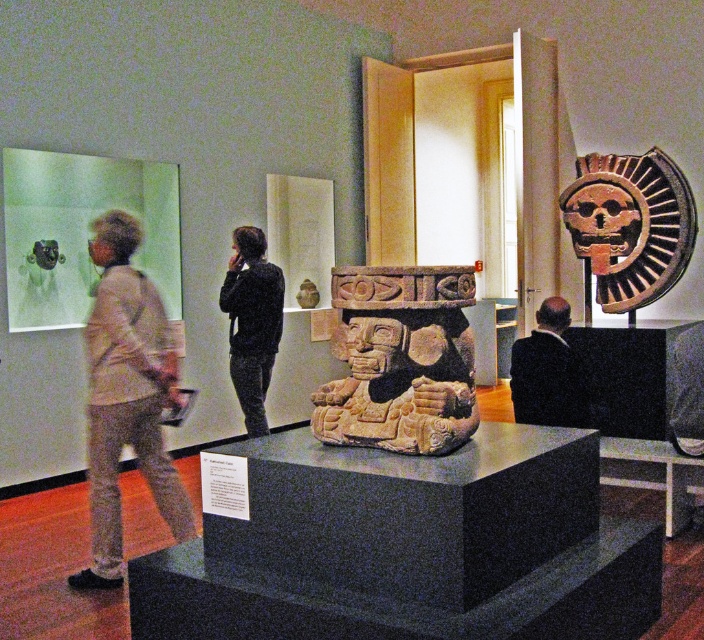
Between carved stone sculpture at center and black textured jacket at center, which one appears on the left side from the viewer's perspective?

black textured jacket at center

This screenshot has height=640, width=704. Describe the element at coordinates (401, 360) in the screenshot. I see `carved stone sculpture at center` at that location.

Between point (470, 339) and point (251, 330), which one is positioned in front?

Point (470, 339)

You are a GUI agent. You are given a task and a screenshot of the screen. Output one action in this format:
    pyautogui.click(x=<x>, y=<y>)
    Task: Click on the carved stone sculpture at center
    The height and width of the screenshot is (640, 704).
    Given the screenshot: What is the action you would take?
    pyautogui.click(x=401, y=360)

How much distance is there between carved stone sculpture at center and light beige sweater at left?

They are 1.53 meters apart.

Is point (367, 388) more distant than point (88, 337)?

No, (367, 388) is closer to viewer.

At what (x,y) coordinates should I click in order to perform the action: click on carved stone sculpture at center. Please return your answer as a coordinate pair (x, y). Looking at the image, I should click on (401, 360).

Which of these two, light beige sweater at left or brown terracotta mask at upper right, stands taller?

With more height is light beige sweater at left.

Can you confirm if light beige sweater at left is smaller than brown terracotta mask at upper right?

Indeed, light beige sweater at left has a smaller size compared to brown terracotta mask at upper right.

Does point (125, 429) lie behind point (631, 280)?

No, it is not.

You are a GUI agent. You are given a task and a screenshot of the screen. Output one action in this format:
    pyautogui.click(x=<x>, y=<y>)
    Task: Click on the light beige sweater at left
    
    Given the screenshot: What is the action you would take?
    pyautogui.click(x=127, y=396)